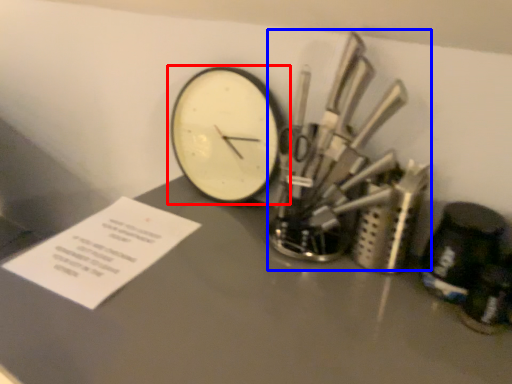
Question: Which point is closer to the camera, wall clock (highlighted by a red box) or tool (highlighted by a blue box)?

Choices:
 (A) wall clock
 (B) tool

Answer: (B)